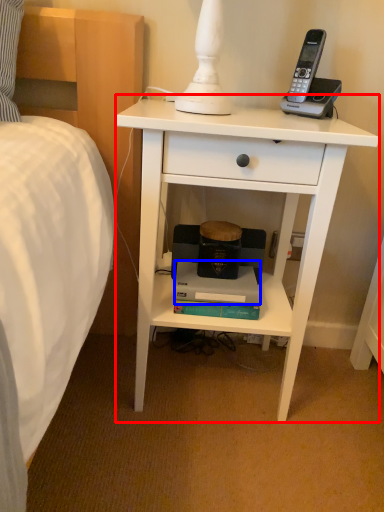
Question: Which object appears farthest to the camera in this image, nightstand (highlighted by a red box) or paperback book (highlighted by a blue box)?

Choices:
 (A) nightstand
 (B) paperback book

Answer: (B)